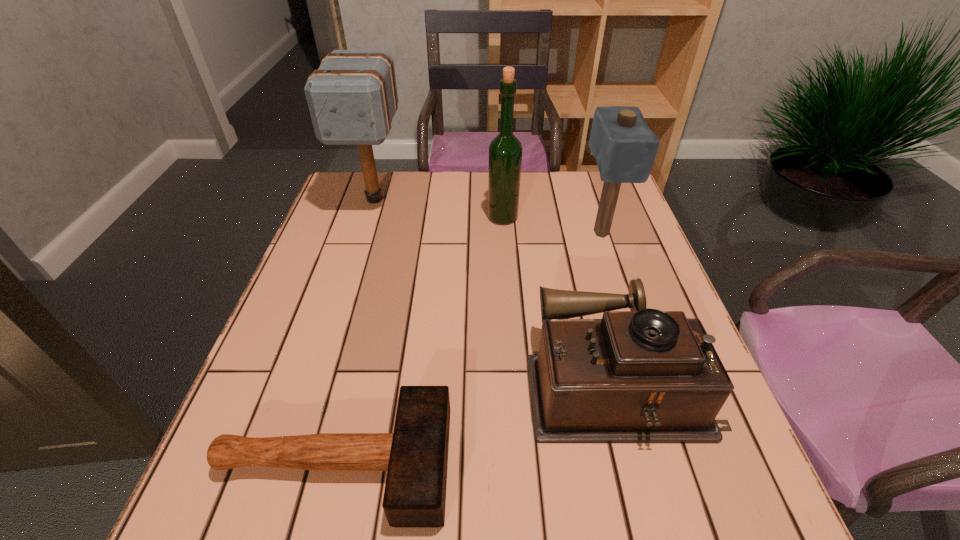
Find the location of `vacant area located on the horn of the phonograph_record`. vacant area located on the horn of the phonograph_record is located at coordinates (493, 381).

The image size is (960, 540). I want to click on vacant space located on the hammer head face of the nearest mallet, so click(531, 463).

The image size is (960, 540). I want to click on liquor located in the far edge section of the desktop, so click(x=505, y=151).

Where is `object situated at the near edge`? The image size is (960, 540). object situated at the near edge is located at coordinates (415, 456).

At what (x,y) coordinates should I click in order to perform the action: click on mallet positioned at the right edge. Please return your answer as a coordinate pair (x, y). This screenshot has height=540, width=960. Looking at the image, I should click on (624, 147).

Locate an element on the screen. phonograph_record located at the right edge is located at coordinates (641, 376).

The width and height of the screenshot is (960, 540). I want to click on object located in the far left corner section of the desktop, so click(x=352, y=97).

Image resolution: width=960 pixels, height=540 pixels. In order to click on object at the near left corner in this screenshot , I will do `click(415, 456)`.

Identify the location of object that is positioned at the far right corner. (624, 147).

This screenshot has height=540, width=960. Identify the location of free space at the far edge of the desktop. (426, 186).